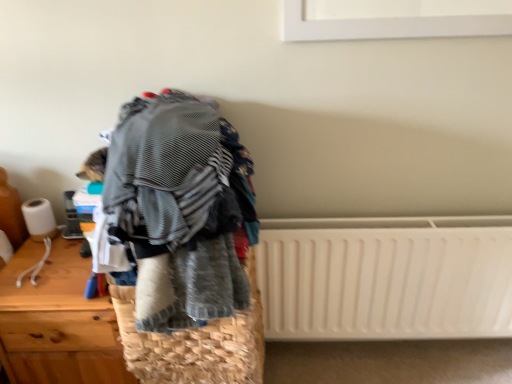
Image resolution: width=512 pixels, height=384 pixels. Identify the location of white plastic radiator at lower right. (386, 277).

The image size is (512, 384). What do you see at coordinates (57, 321) in the screenshot?
I see `wooden chest of drawers at left` at bounding box center [57, 321].

Where is `woven straw basket at center`? The image size is (512, 384). woven straw basket at center is located at coordinates (194, 344).

Where is `white plastic radiator at lower right`? Image resolution: width=512 pixels, height=384 pixels. white plastic radiator at lower right is located at coordinates (386, 277).

Based on the photo, which of these two, striped fabric at center or white plastic radiator at lower right, stands taller?

Standing taller between the two is white plastic radiator at lower right.

Is striped fabric at center not near white plastic radiator at lower right?

No, striped fabric at center is in close proximity to white plastic radiator at lower right.

How far apart are striped fabric at center and white plastic radiator at lower right?

striped fabric at center is 24.44 inches away from white plastic radiator at lower right.

Is point (212, 175) positioned after point (430, 292)?

No, (212, 175) is closer to viewer.

Based on the photo, considering the relative sizes of woven straw basket at center and wooden chest of drawers at left in the image provided, is woven straw basket at center wider than wooden chest of drawers at left?

In fact, woven straw basket at center might be narrower than wooden chest of drawers at left.

Is woven straw basket at center not inside wooden chest of drawers at left?

woven straw basket at center lies outside wooden chest of drawers at left's area.

Image resolution: width=512 pixels, height=384 pixels. Identify the location of furniture behind the woven straw basket at center. (57, 321).

Consider the image. Measure the distance from woven straw basket at center to wooden chest of drawers at left.

A distance of 8.85 inches exists between woven straw basket at center and wooden chest of drawers at left.

Is white plastic radiator at lower right closer to camera compared to woven straw basket at center?

No, it is behind woven straw basket at center.

You are a GUI agent. You are given a task and a screenshot of the screen. Output one action in this format:
    pyautogui.click(x=<x>, y=<y>)
    Task: Click on the basket above the white plastic radiator at lower right (from the image's perspective)
    Image resolution: width=512 pixels, height=384 pixels.
    Given the screenshot: What is the action you would take?
    pyautogui.click(x=194, y=344)

From the image's perspective, which is above, white plastic radiator at lower right or woven straw basket at center?

From the image's view, woven straw basket at center is above.

Is white plastic radiator at lower right turned away from woven straw basket at center?

white plastic radiator at lower right does not have its back to woven straw basket at center.

From a real-world perspective, between wooden chest of drawers at left and woven straw basket at center, who is vertically lower?

wooden chest of drawers at left, from a real-world perspective.

Does wooden chest of drawers at left have a greater height compared to woven straw basket at center?

Yes, wooden chest of drawers at left is taller than woven straw basket at center.

Is woven straw basket at center at the back of wooden chest of drawers at left?

wooden chest of drawers at left is not turned away from woven straw basket at center.

Is wooden chest of drawers at left positioned far away from woven straw basket at center?

No.

Which point is more forward, (x=170, y=342) or (x=311, y=241)?

Point (x=170, y=342)

How distant is woven straw basket at center from white plastic radiator at lower right?

43.75 centimeters.

This screenshot has height=384, width=512. I want to click on basket above the white plastic radiator at lower right (from the image's perspective), so click(x=194, y=344).

Is woven straw basket at center in contact with white plastic radiator at lower right?

woven straw basket at center and white plastic radiator at lower right are clearly separated.

Is striped fabric at center facing towards woven straw basket at center?

No, striped fabric at center does not turn towards woven straw basket at center.

This screenshot has width=512, height=384. In order to click on basket behind the striped fabric at center in this screenshot , I will do `click(194, 344)`.

Is striped fabric at center wider or thinner than woven straw basket at center?

Considering their sizes, striped fabric at center looks broader than woven straw basket at center.

Which object is further away from the camera, striped fabric at center or woven straw basket at center?

woven straw basket at center is further away from the camera.

Would you say white plastic radiator at lower right is outside wooden chest of drawers at left?

Yes, white plastic radiator at lower right is not within wooden chest of drawers at left.

From a real-world perspective, which object rests below the other?

wooden chest of drawers at left is physically lower.

Between white plastic radiator at lower right and wooden chest of drawers at left, which one has larger size?

Bigger between the two is wooden chest of drawers at left.

Which object is further away from the camera taking this photo, white plastic radiator at lower right or wooden chest of drawers at left?

white plastic radiator at lower right is further from the camera.

In the image, there is a white plastic radiator at lower right. What are the coordinates of `textile above it (from the image's perspective)` in the screenshot? It's located at (179, 208).

The width and height of the screenshot is (512, 384). Identify the location of basket lying on the right of wooden chest of drawers at left. (194, 344).

Which object lies further to the anchor point striped fabric at center, woven straw basket at center or wooden chest of drawers at left?

Based on the image, wooden chest of drawers at left appears to be further to striped fabric at center.

Which object lies further to the anchor point striped fabric at center, white plastic radiator at lower right or woven straw basket at center?

white plastic radiator at lower right.

Which object lies nearer to the anchor point wooden chest of drawers at left, woven straw basket at center or striped fabric at center?

woven straw basket at center.

Looking at the image, which one is located further to white plastic radiator at lower right, striped fabric at center or woven straw basket at center?

striped fabric at center lies further to white plastic radiator at lower right than the other object.

Based on their spatial positions, is wooden chest of drawers at left or woven straw basket at center closer to white plastic radiator at lower right?

Among the two, woven straw basket at center is located nearer to white plastic radiator at lower right.

Based on the photo, estimate the real-world distances between objects in this image. Which object is closer to woven straw basket at center, wooden chest of drawers at left or striped fabric at center?

The object closer to woven straw basket at center is wooden chest of drawers at left.

Based on their spatial positions, is white plastic radiator at lower right or wooden chest of drawers at left closer to striped fabric at center?

wooden chest of drawers at left.

Considering their positions, is woven straw basket at center positioned closer to striped fabric at center than white plastic radiator at lower right?

woven straw basket at center lies closer to striped fabric at center than the other object.

The width and height of the screenshot is (512, 384). I want to click on basket between striped fabric at center and white plastic radiator at lower right from left to right, so click(x=194, y=344).

Locate an element on the screen. basket situated between wooden chest of drawers at left and white plastic radiator at lower right from left to right is located at coordinates (194, 344).

You are a GUI agent. You are given a task and a screenshot of the screen. Output one action in this format:
    pyautogui.click(x=<x>, y=<y>)
    Task: Click on the textile situated between wooden chest of drawers at left and white plastic radiator at lower right from left to right
    
    Given the screenshot: What is the action you would take?
    pyautogui.click(x=179, y=208)

Where is `basket between striped fabric at center and wooden chest of drawers at left from top to bottom`? Image resolution: width=512 pixels, height=384 pixels. basket between striped fabric at center and wooden chest of drawers at left from top to bottom is located at coordinates (x=194, y=344).